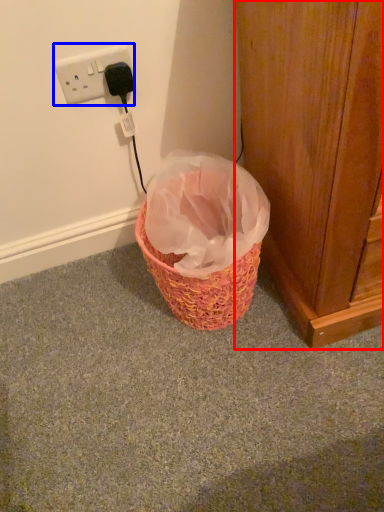
Question: Which object appears farthest to the camera in this image, door (highlighted by a red box) or power plugs and sockets (highlighted by a blue box)?

Choices:
 (A) door
 (B) power plugs and sockets

Answer: (B)